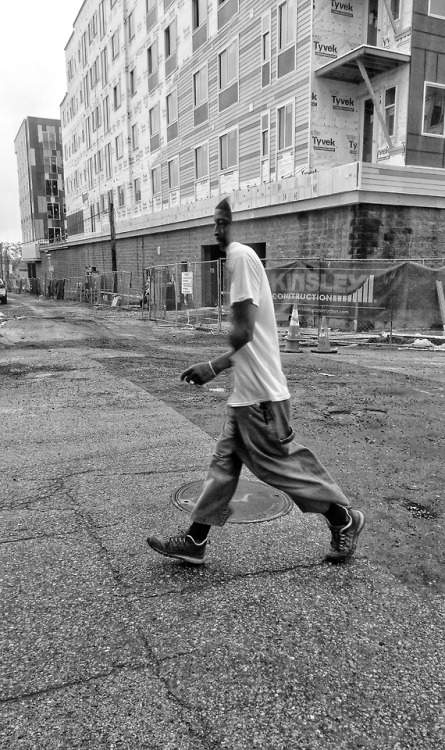
Locate an element on the screen. The height and width of the screenshot is (750, 445). sock is located at coordinates (199, 529), (336, 517).